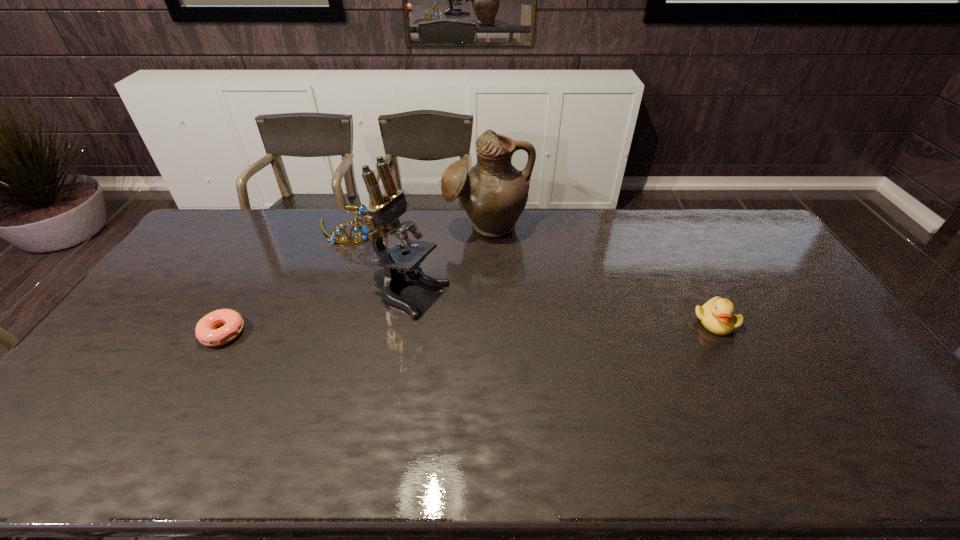
I want to click on free space on the desktop that is between the doughnut and the rightmost object and is positioned on the front-facing side of the fourth object from right to left, so click(x=450, y=328).

Where is `vacant space on the desktop that is between the doughnut and the rightmost object and is positioned at the eyepieces of the microscope`? vacant space on the desktop that is between the doughnut and the rightmost object and is positioned at the eyepieces of the microscope is located at coordinates (482, 327).

You are a GUI agent. You are given a task and a screenshot of the screen. Output one action in this format:
    pyautogui.click(x=<x>, y=<y>)
    Task: Click on the vacant space on the desktop that is between the doughnut and the fourth tallest object and is positioned at the spout of the second tallest object
    
    Given the screenshot: What is the action you would take?
    pyautogui.click(x=499, y=326)